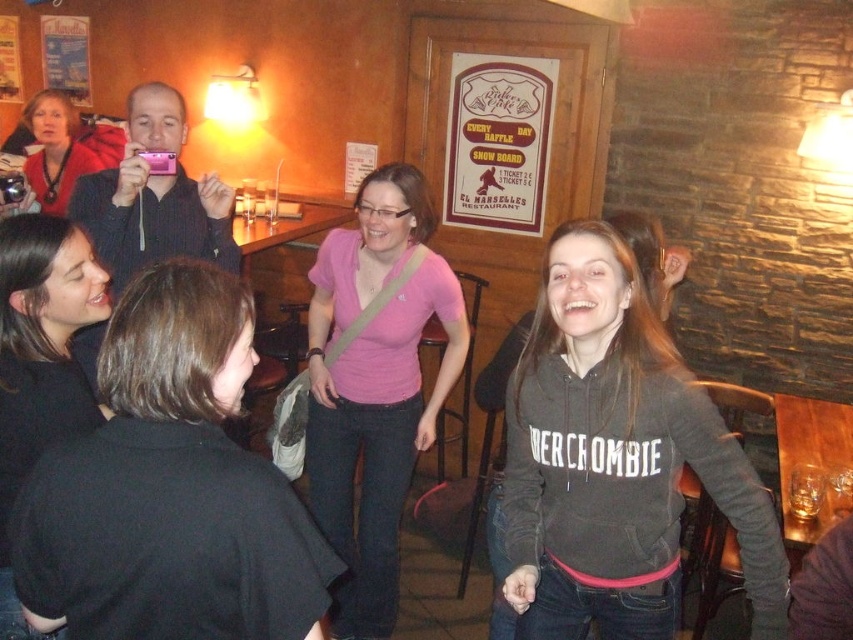
You are a photographer trying to capture a candid shot of the social gathering in the scene. The camera you have is positioned at point (x=154, y=196). What object is located at that point?

The point (x=154, y=196) marks the location of the matte black camera at upper left.

You are taking a photo of the scene and notice the matte black camera at upper left and the matte black jacket at upper left. Which object is shorter in height?

The matte black camera at upper left is shorter in height compared to the matte black jacket at upper left.

You are standing in the dining area and want to reach the point marked at coordinates point (161,116). If your walking speed is 1.2 meters per second, how many seconds will it take you to reach that point?

The distance between you and point (161,116) is 2.49 meters. At a speed of 1.2 meters per second, it will take approximately 2.08 seconds to reach the point.